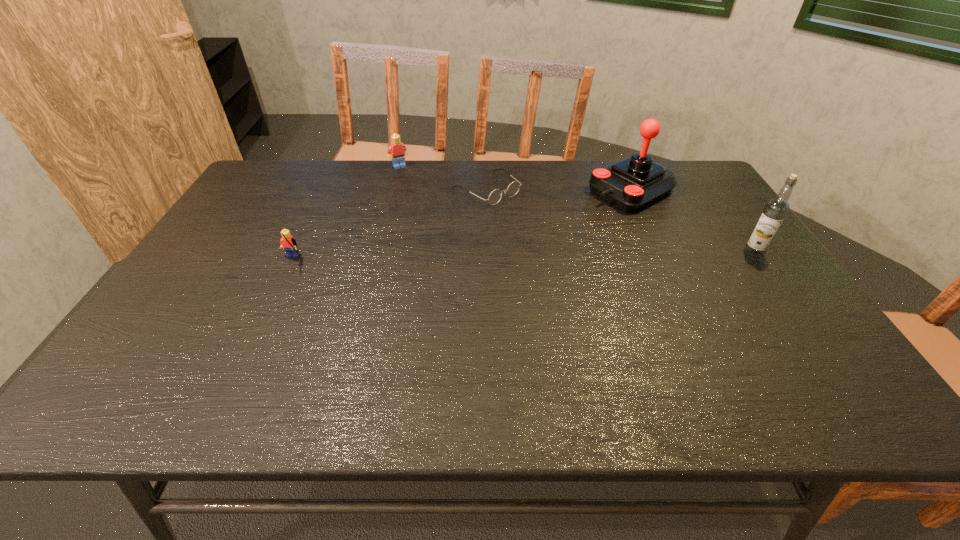
The height and width of the screenshot is (540, 960). I want to click on free space at the right edge, so click(704, 217).

In the image, there is a desktop. At what (x,y) coordinates should I click in order to perform the action: click on free space at the far left corner. Please return your answer as a coordinate pair (x, y). The height and width of the screenshot is (540, 960). Looking at the image, I should click on (308, 160).

The width and height of the screenshot is (960, 540). I want to click on free space at the far right corner, so click(677, 171).

What are the coordinates of `free space between the vodka and the left Lego` in the screenshot? It's located at (522, 257).

Identify the location of free space between the third object from right to left and the vodka. The height and width of the screenshot is (540, 960). (620, 221).

Where is `free space between the rightmost object and the nearer Lego`? The image size is (960, 540). free space between the rightmost object and the nearer Lego is located at coordinates (522, 257).

Where is `blank region between the leftmost object and the rightmost object`? blank region between the leftmost object and the rightmost object is located at coordinates (522, 257).

In order to click on vacant space that's between the right Lego and the rightmost object in this screenshot , I will do `click(576, 210)`.

In order to click on vacant space in between the shortest object and the nearer Lego in this screenshot , I will do `click(389, 225)`.

The image size is (960, 540). Identify the location of vacant area that lies between the left Lego and the joystick. (461, 226).